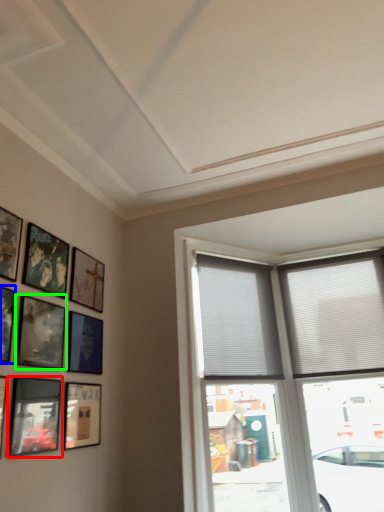
Question: Which is nearer to the picture frame (highlighted by a red box)? picture frame (highlighted by a blue box) or picture frame (highlighted by a green box).

Choices:
 (A) picture frame
 (B) picture frame

Answer: (B)